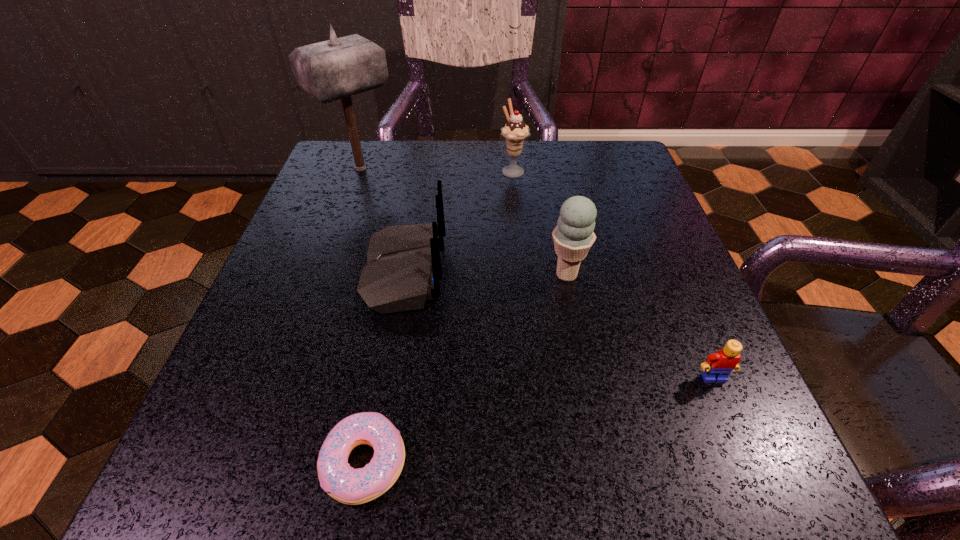
Where is `object that stands as the fourth closest to the left ice cream`? This screenshot has width=960, height=540. object that stands as the fourth closest to the left ice cream is located at coordinates (718, 366).

Select which object appears as the second closest to the router. Please provide its 2D coordinates. Your answer should be formatted as a tuple, i.e. [(x, y)], where the tuple contains the x and y coordinates of a point satisfying the conditions above.

[(345, 484)]